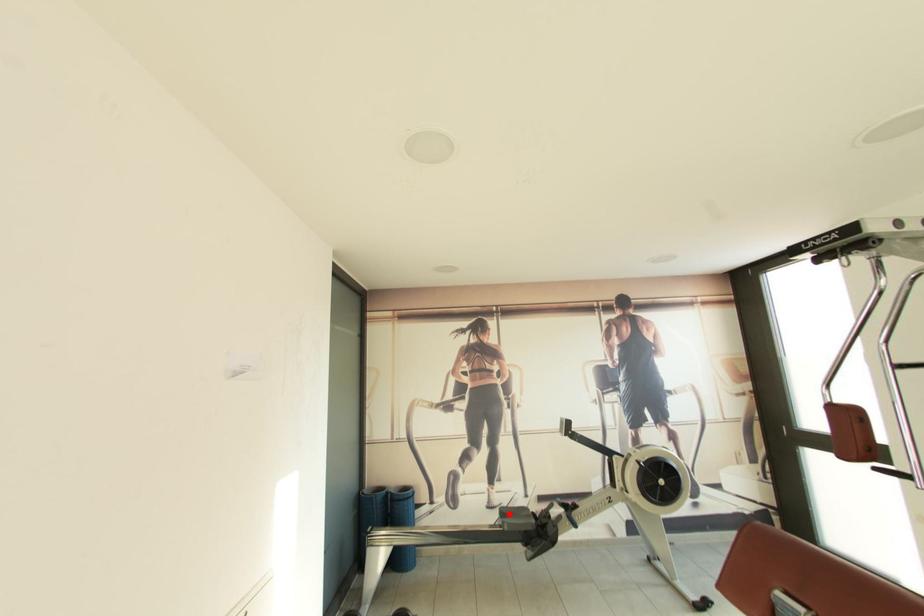
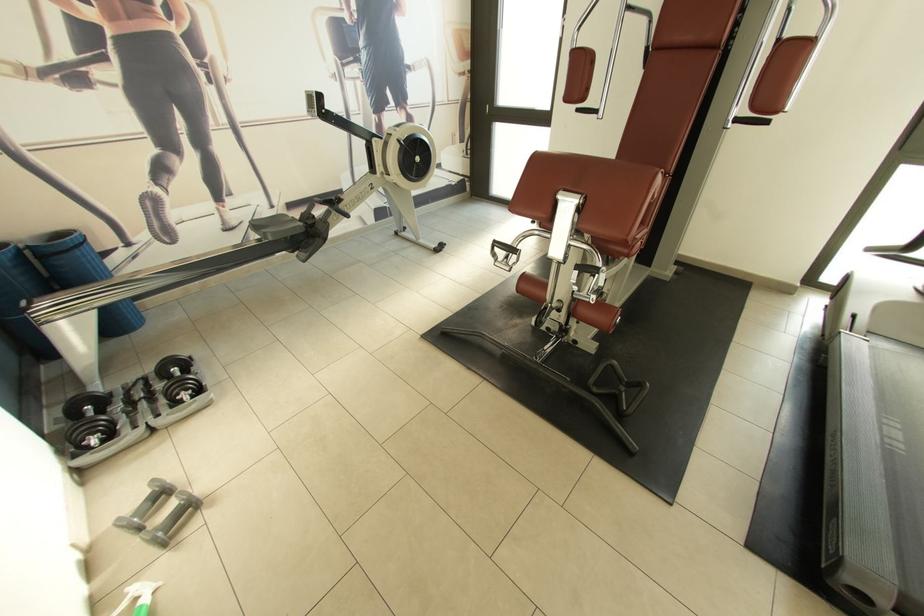
Question: I am providing you with two images of the same scene from different viewpoints. A red point is shown in image1. For the corresponding object point in image2, is it positioned nearer or farther from the camera?

Choices:
 (A) Nearer
 (B) Farther

Answer: (A)